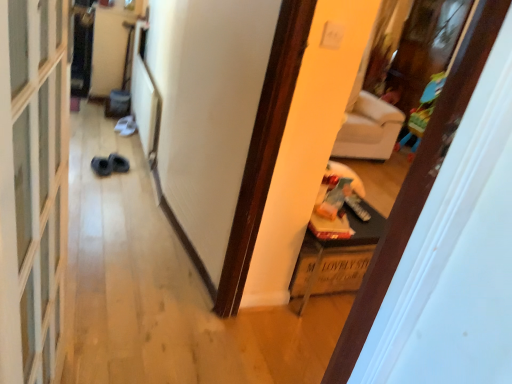
Question: Based on their sizes in the image, would you say black suede shoes at lower left is bigger or smaller than wooden crate at lower right?

Choices:
 (A) big
 (B) small

Answer: (B)

Question: From the image's perspective, is black suede shoes at lower left positioned above or below wooden crate at lower right?

Choices:
 (A) below
 (B) above

Answer: (B)

Question: Which object is positioned closest to the wooden crate at lower right?

Choices:
 (A) black suede shoes at lower left
 (B) plastic colorful playpen at upper right
 (C) transparent glass screen door at left
 (D) white matte door at center

Answer: (D)

Question: Which of these objects is positioned farthest from the transparent glass screen door at left?

Choices:
 (A) black suede shoes at lower left
 (B) wooden crate at lower right
 (C) plastic colorful playpen at upper right
 (D) white matte door at center

Answer: (C)